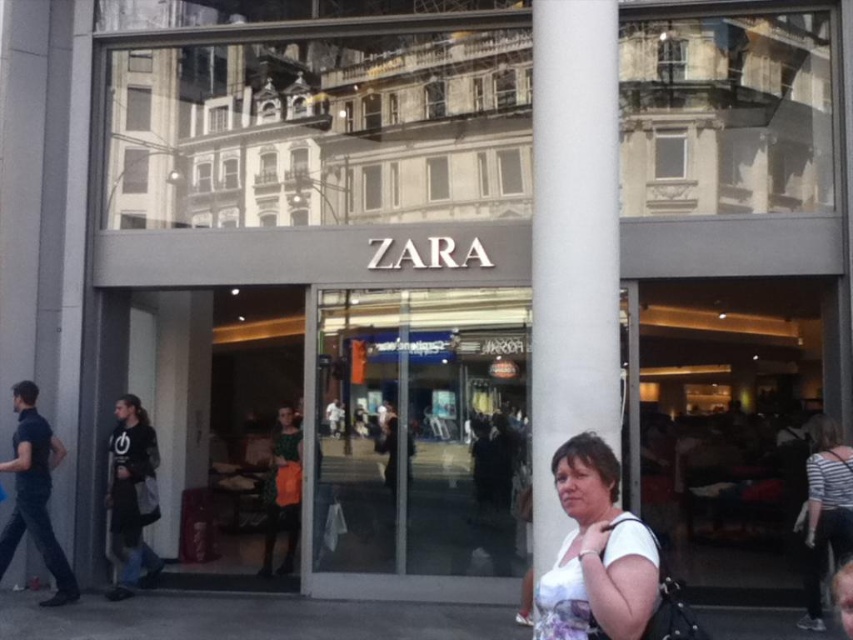
Can you confirm if white fabric at lower right is positioned to the left of green textured dress at center?

No, white fabric at lower right is not to the left of green textured dress at center.

Based on the photo, is the position of white fabric at lower right less distant than that of green textured dress at center?

Yes, white fabric at lower right is in front of green textured dress at center.

Is point (618, 593) more distant than point (274, 444)?

No.

Find the location of a particular element. The width and height of the screenshot is (853, 640). white fabric at lower right is located at coordinates (595, 552).

Can you confirm if white smooth pillar at center is bigger than white striped shirt at lower right?

Correct, white smooth pillar at center is larger in size than white striped shirt at lower right.

What do you see at coordinates (572, 243) in the screenshot?
I see `white smooth pillar at center` at bounding box center [572, 243].

Who is more distant from viewer, (601, 122) or (817, 420)?

Positioned behind is point (817, 420).

Where is `white smooth pillar at center`? The image size is (853, 640). white smooth pillar at center is located at coordinates (572, 243).

Which is below, dark blue cotton shirt at left or black cotton shirt at left?

black cotton shirt at left is below.

Is dark blue cotton shirt at left further to camera compared to black cotton shirt at left?

No, it is not.

The height and width of the screenshot is (640, 853). Find the location of `dark blue cotton shirt at left`. dark blue cotton shirt at left is located at coordinates (33, 493).

Find the location of a particular element. The width and height of the screenshot is (853, 640). dark blue cotton shirt at left is located at coordinates (33, 493).